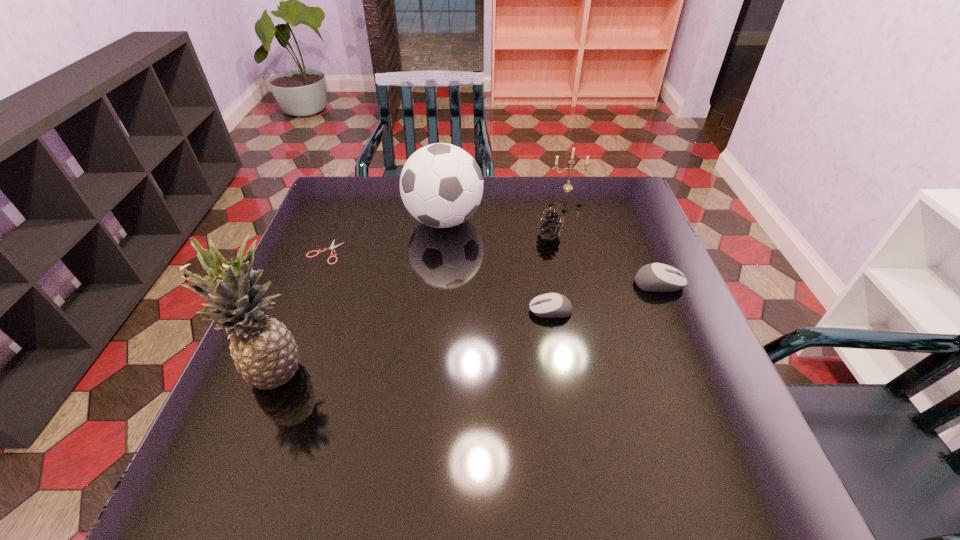
In the image, there is a desktop. In order to click on vacant space at the near edge in this screenshot , I will do `click(559, 416)`.

In the image, there is a desktop. Where is `free space at the left edge`? free space at the left edge is located at coordinates (311, 230).

At what (x,y) coordinates should I click in order to perform the action: click on vacant space at the right edge of the desktop. Please return your answer as a coordinate pair (x, y). Looking at the image, I should click on (636, 316).

Image resolution: width=960 pixels, height=540 pixels. In order to click on free spot at the far left corner of the desktop in this screenshot , I will do `click(373, 190)`.

In the image, there is a desktop. Where is `vacant space at the far right corner`? The image size is (960, 540). vacant space at the far right corner is located at coordinates (612, 212).

The width and height of the screenshot is (960, 540). Identify the location of vacant space in between the left computer equipment and the third tallest object. (559, 249).

Identify the location of free space between the shorter computer equipment and the pinecone. (550, 273).

Image resolution: width=960 pixels, height=540 pixels. Find the location of `vacant space that is in between the shorter computer equipment and the fifth object from right to left`. vacant space that is in between the shorter computer equipment and the fifth object from right to left is located at coordinates (497, 266).

In order to click on free space between the pinecone and the shears in this screenshot , I will do `click(437, 243)`.

Locate an element on the screen. empty location between the candle and the left computer equipment is located at coordinates point(559,249).